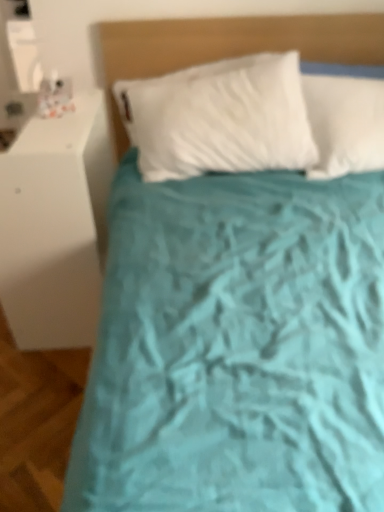
Find the location of a particular element. blank space situated above white matte dresser at left (from a real-world perspective) is located at coordinates (53, 127).